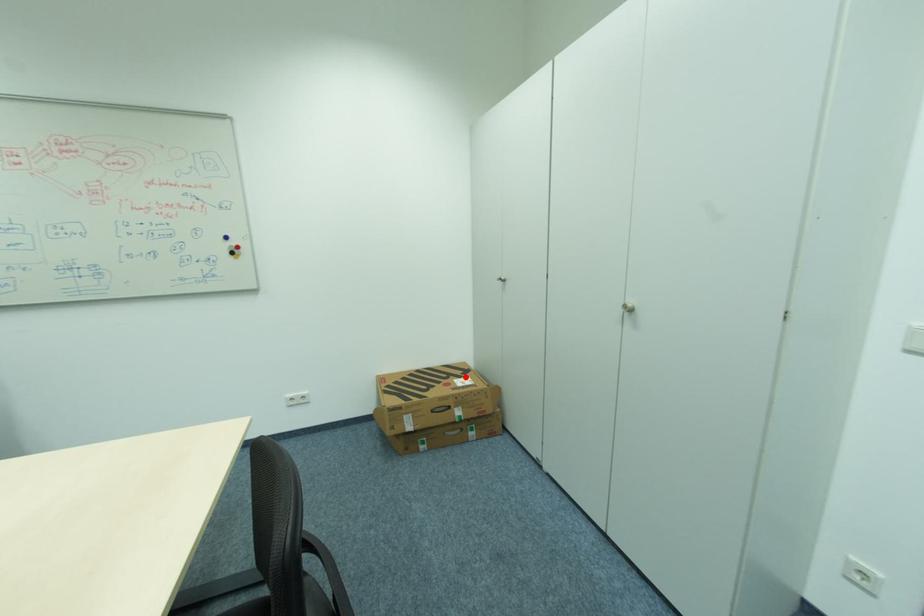
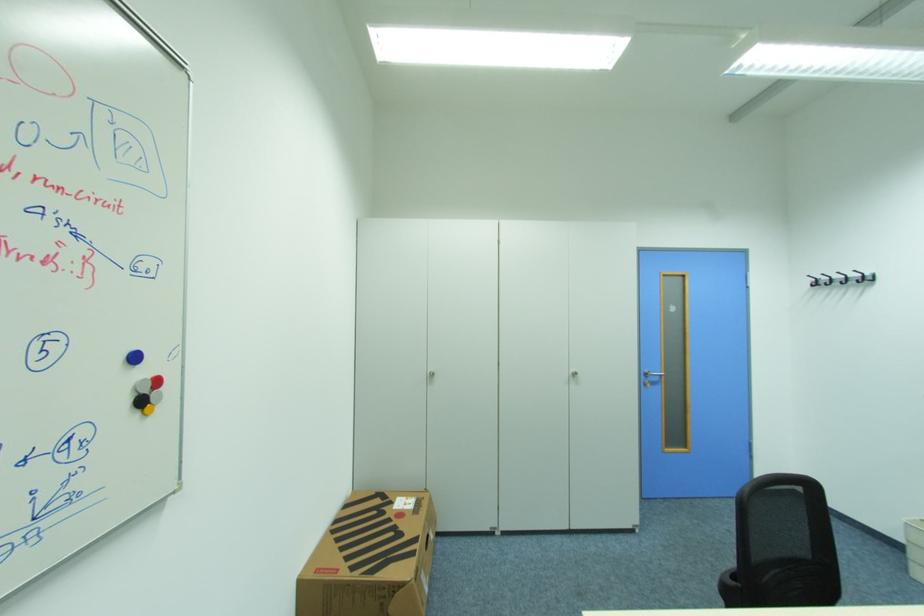
The point at the highlighted location is marked in the first image. Where is the corresponding point in the second image?

(396, 503)